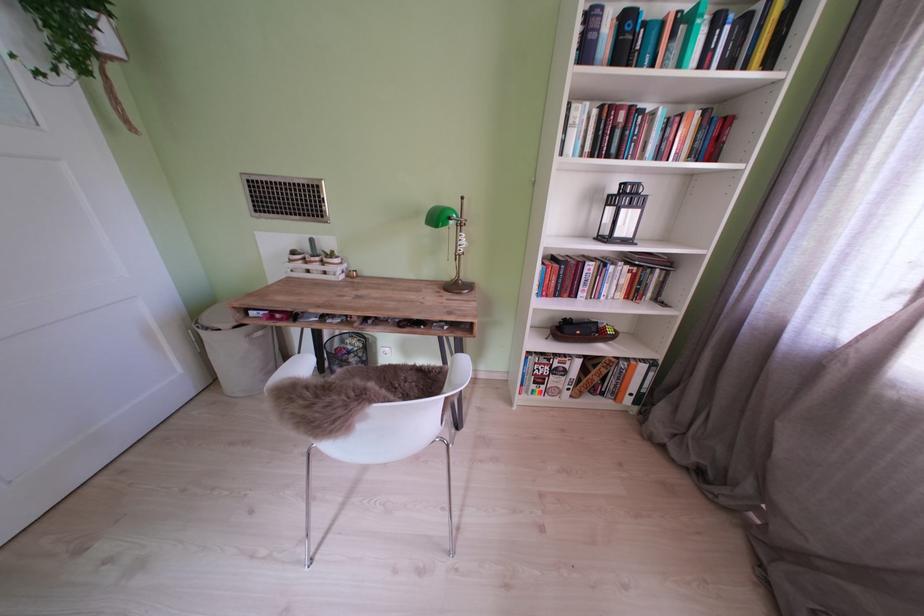
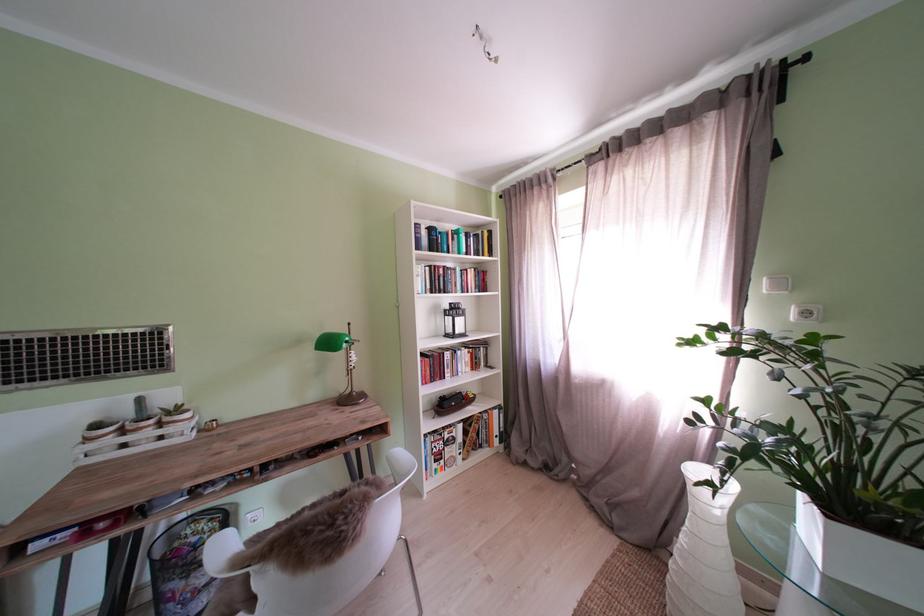
Find the pixel in the second image that matches point 565,361 in the first image.

(456, 434)